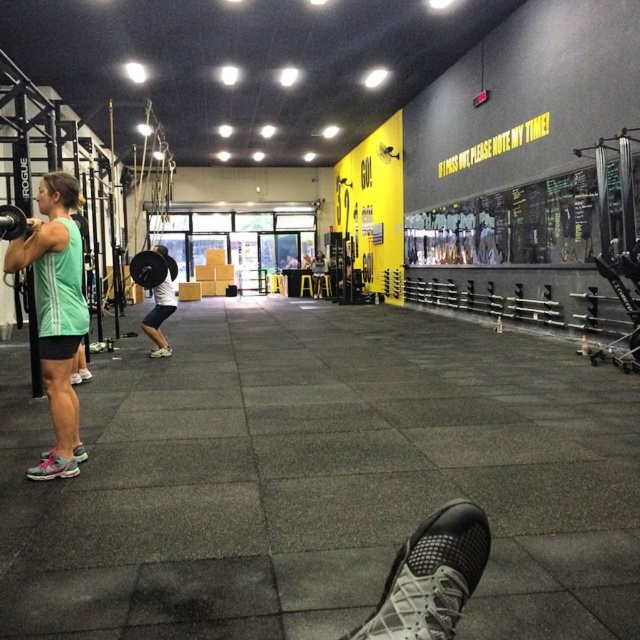
You are standing in the gym and want to place a new poster on the wall. The gym has two specific points marked for installation. The first point is at coordinates point [369,637] and the second is at point [141,257]. Which point is closer to you so that you can reach it easily?

Point [369,637] is closer to the viewer than point [141,257], so you can reach it easily.

Based on the gym scene described, which object is located at the coordinates point (54, 314)?

The green matte tank top at center is located at point (54, 314).

You are a gym trainer observing the scene. You notice the pink mesh shoe at lower left and the black rubber barbell at center. Which object is positioned lower in the image?

The pink mesh shoe at lower left is located below the black rubber barbell at center, so it is positioned lower in the image.